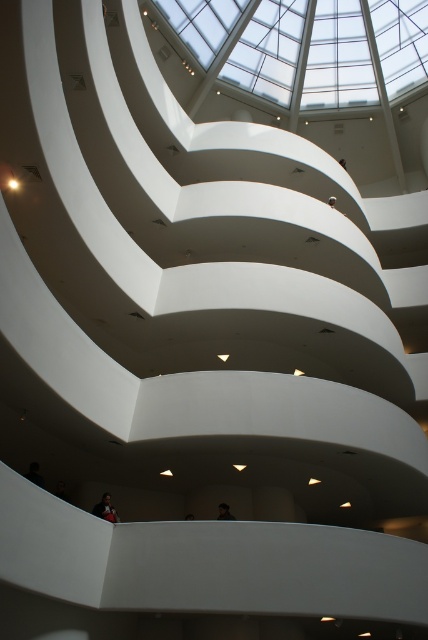
Does dark brown leather jacket at lower center have a greater width compared to dark brown hair at upper center?

Indeed, dark brown leather jacket at lower center has a greater width compared to dark brown hair at upper center.

Is dark brown leather jacket at lower center in front of dark brown hair at upper center?

Yes.

Is point (109, 512) positioned behind point (225, 518)?

No, it is in front of (225, 518).

The image size is (428, 640). I want to click on dark brown leather jacket at lower center, so click(106, 508).